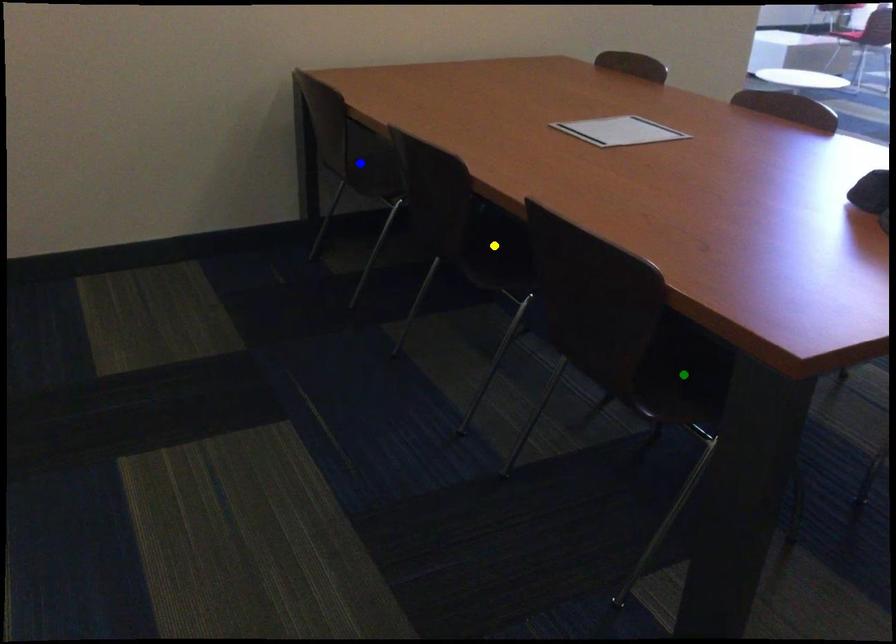
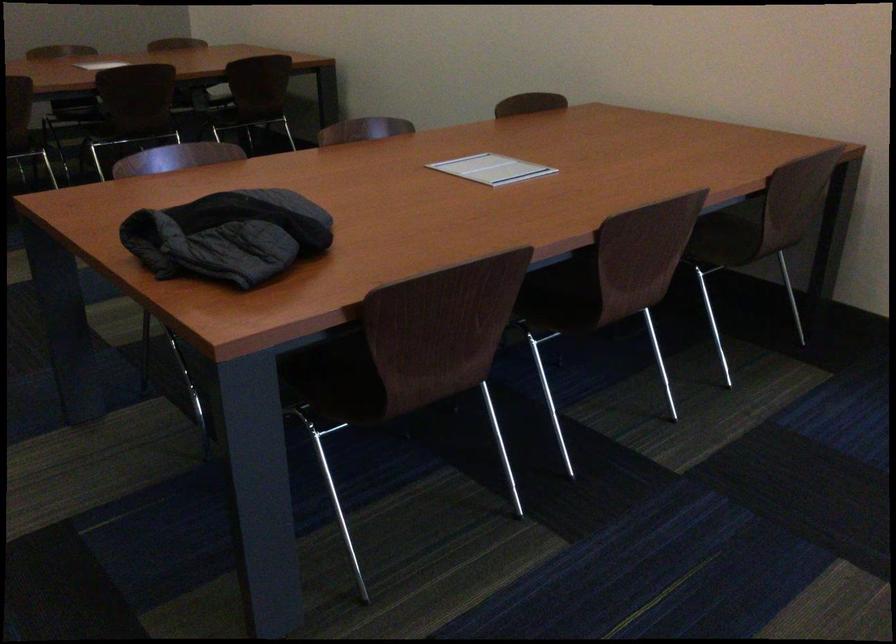
I am providing you with two images of the same scene from different viewpoints. Three points are marked in image1. Which point corresponds to a part or object that is occluded in image2?In image1, three points are marked. Which of them correspond to a part or object that is occluded in image2?Among the three points shown in image1, which one corresponds to a part or object that is no longer visible due to occlusion in image2?

blue point, yellow point, green point